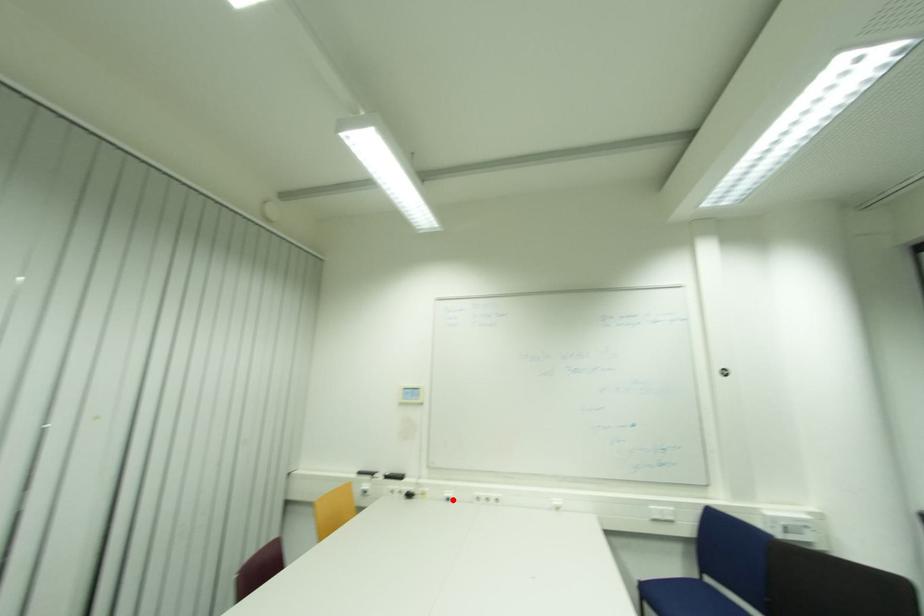
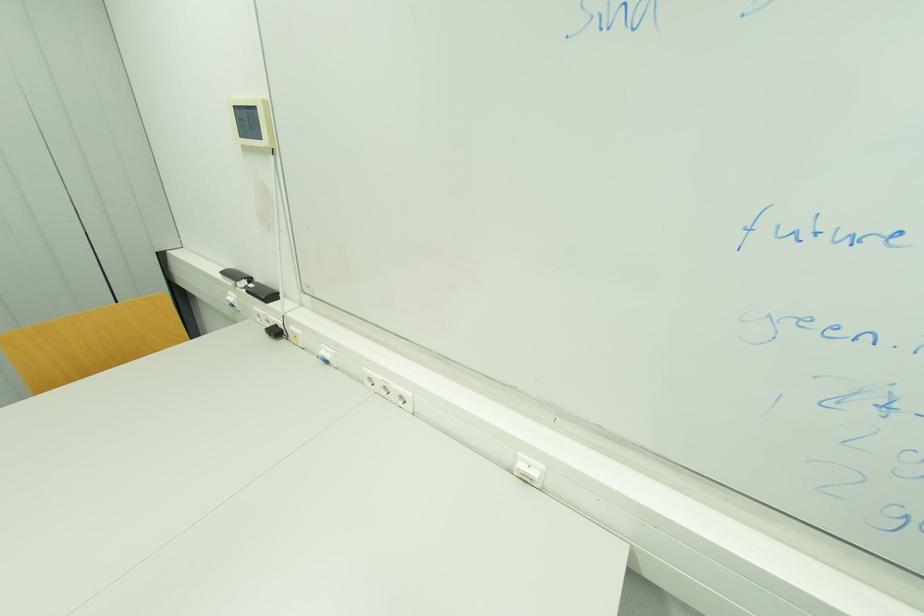
Find the pixel in the second image that matches the highlighted location in the first image.

(330, 362)